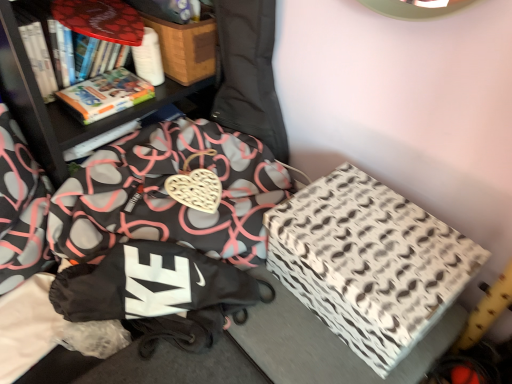
Find the location of a particular element. The height and width of the screenshot is (384, 512). empty space that is ontop of white-patterned cardboard box at right, the second cardboard box viewed from the left (from a real-world perspective) is located at coordinates point(380,236).